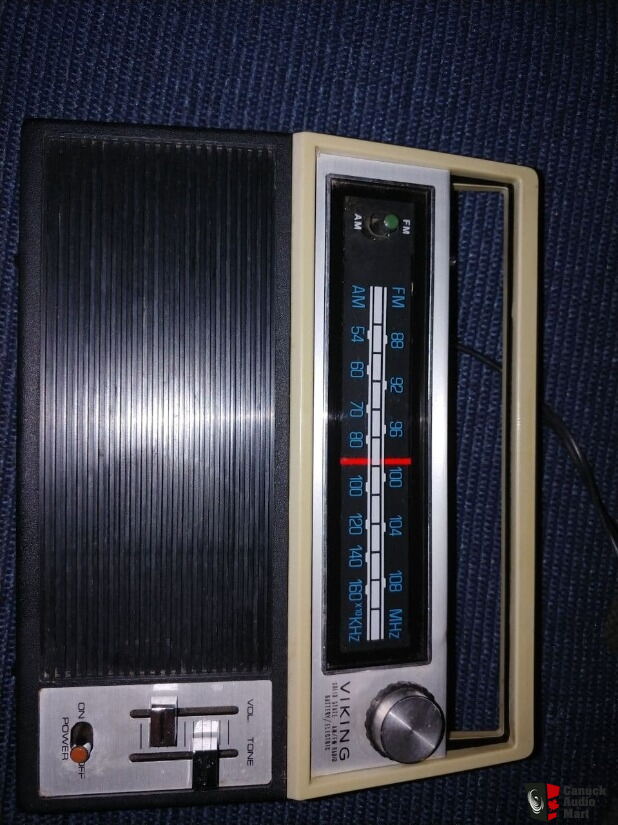
Identify the location of power switch. (77, 747).